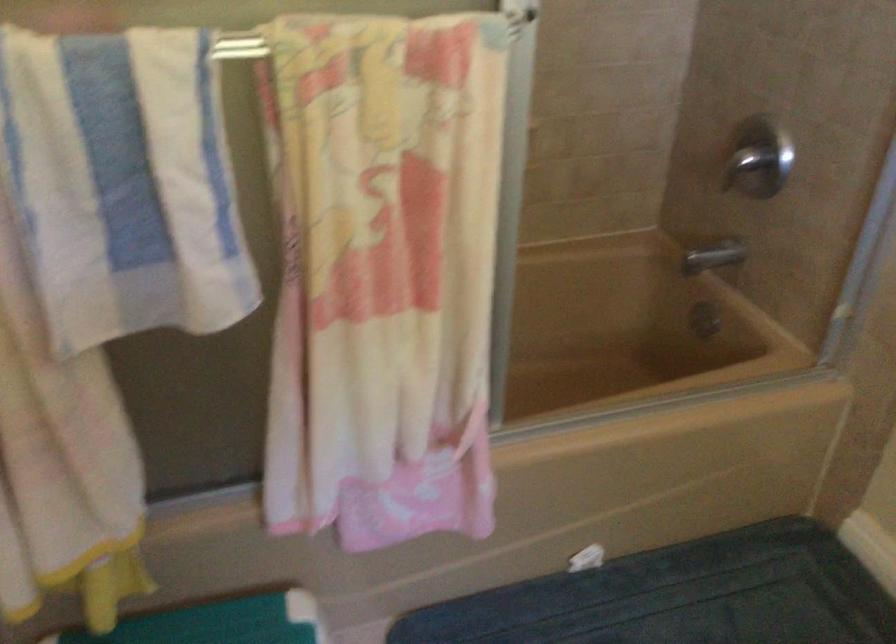
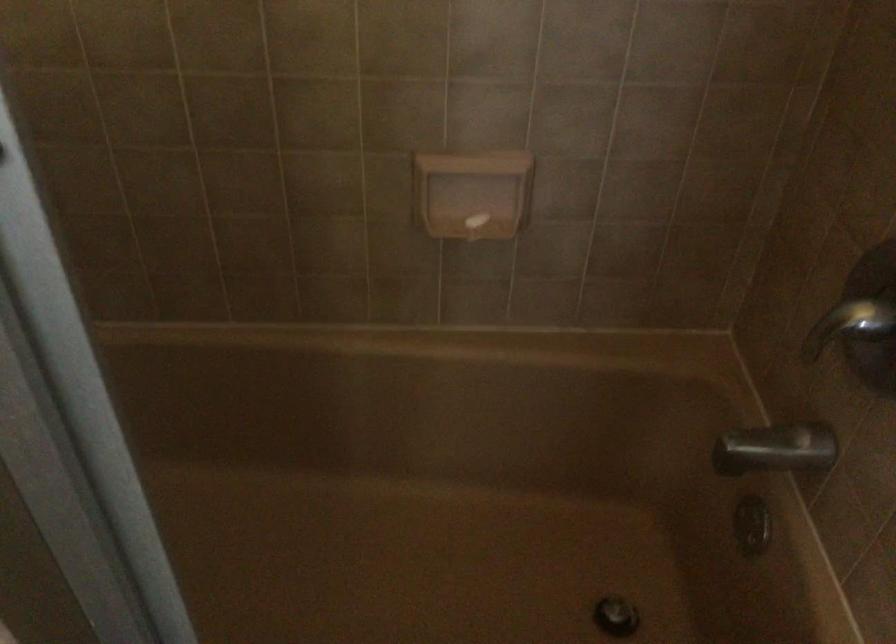
In the second image, find the point that corresponds to the point at 742,164 in the first image.

(849, 325)